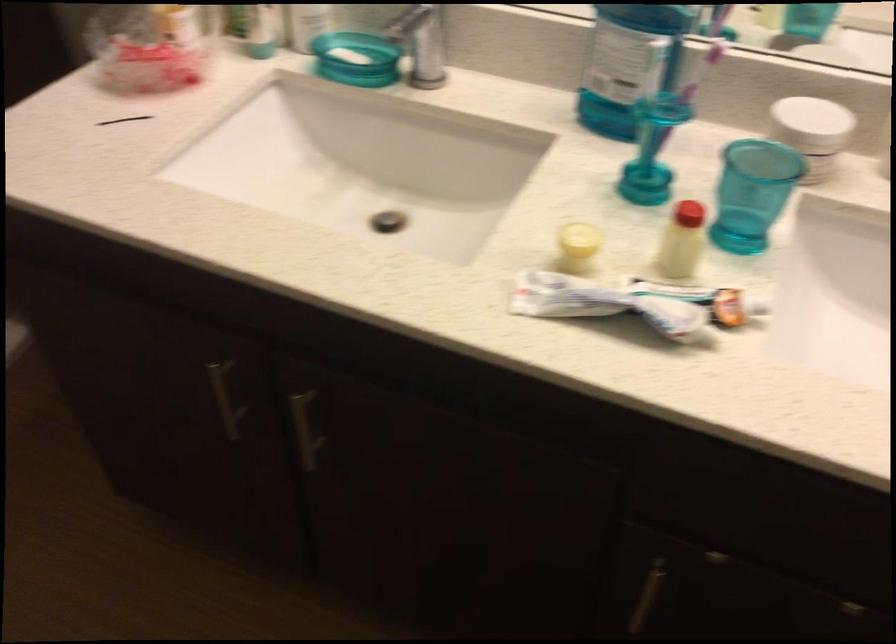
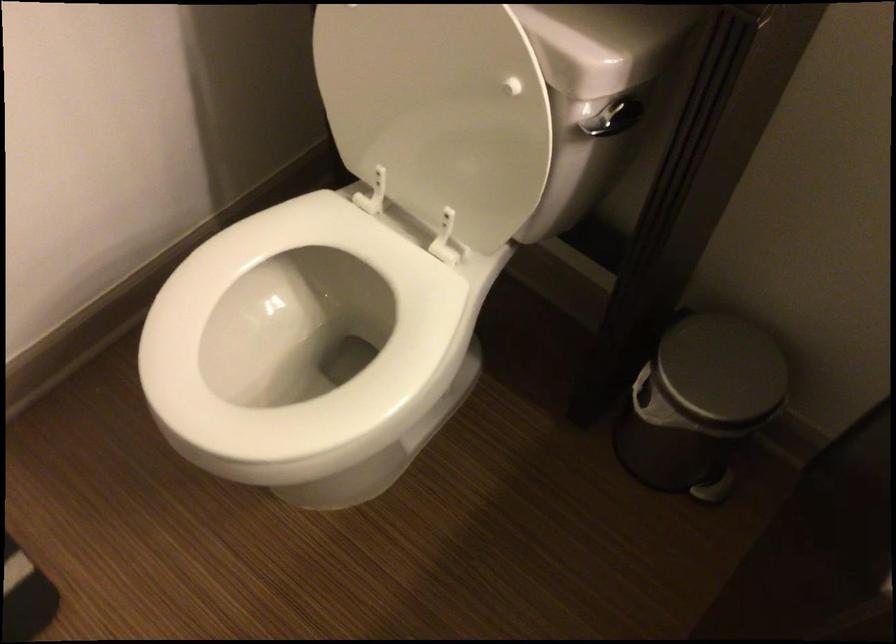
In a continuous first-person perspective shot, in which direction is the camera moving?

The movement direction of the cameraman is left, forward.